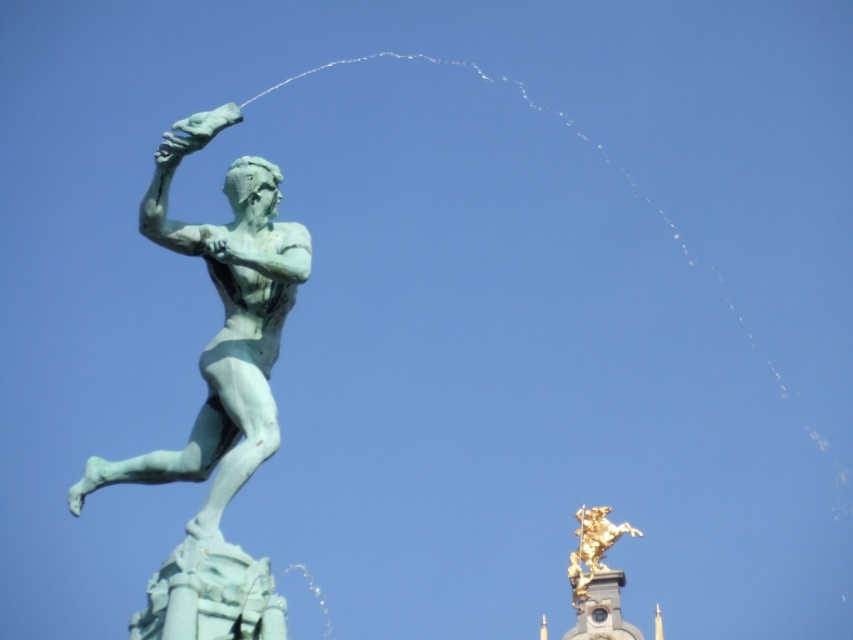
You are standing in front of the statues and want to take a photo that includes both the green patina statue at left and the gold metallic horse at upper right. Which statue should you position closer to the center of your camera frame to ensure both are visible?

To ensure both the green patina statue at left and the gold metallic horse at upper right are visible in your photo, position the green patina statue at left closer to the center of your camera frame since it is to the left of the gold metallic horse at upper right.

Looking at this image, you are standing in a park and see the green patina statue at left. If you want to get closer to it, how many steps do you need to take if each step covers 2.5 feet?

The green patina statue at left is 184.16 feet away. Dividing the distance by the step length of 2.5 feet gives approximately 73.66 steps. Since you can only take whole steps, you would need to take 74 steps to reach it.